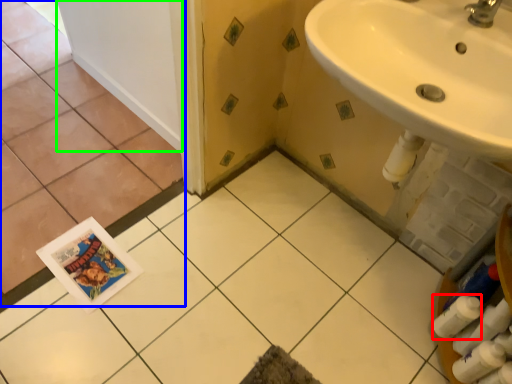
Question: Considering the real-world distances, which object is farthest from toilet paper (highlighted by a red box)? ceramic tile (highlighted by a blue box) or door (highlighted by a green box)?

Choices:
 (A) ceramic tile
 (B) door

Answer: (B)